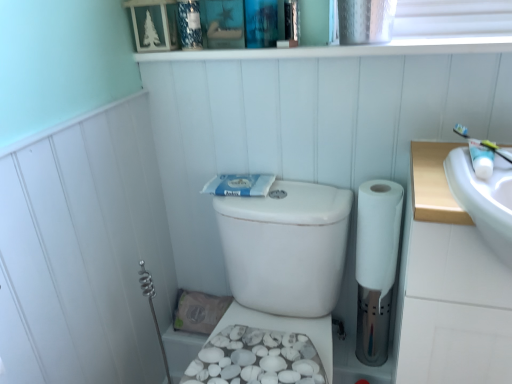
Find the location of a particular element. free spot to the left of white plastic toothbrush at upper right is located at coordinates (439, 177).